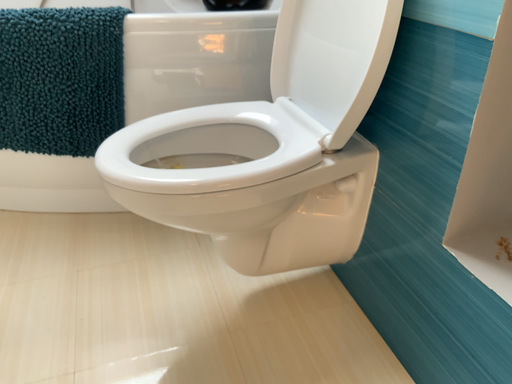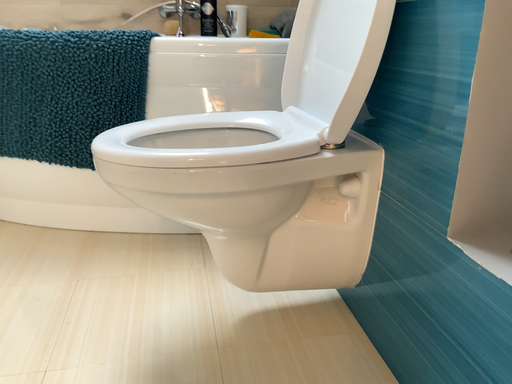
Question: How did the camera likely rotate when shooting the video?

Choices:
 (A) rotated downward
 (B) rotated upward

Answer: (B)